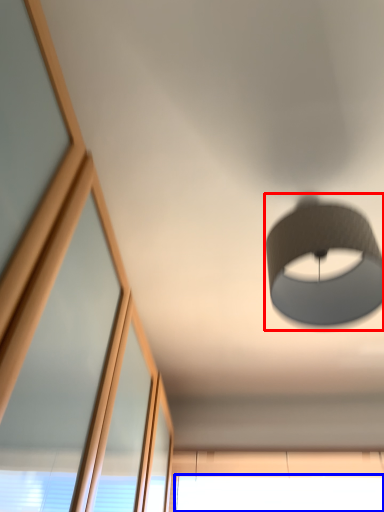
Question: Which point is further to the camera, lamp (highlighted by a red box) or window (highlighted by a blue box)?

Choices:
 (A) lamp
 (B) window

Answer: (B)